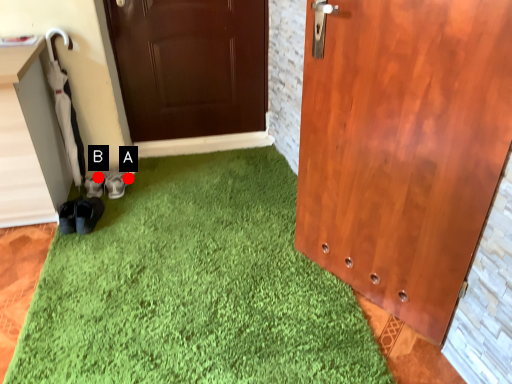
Question: Two points are circled on the image, labeled by A and B beside each circle. Which point appears farthest from the camera in this image?

Choices:
 (A) A is further
 (B) B is further

Answer: (A)